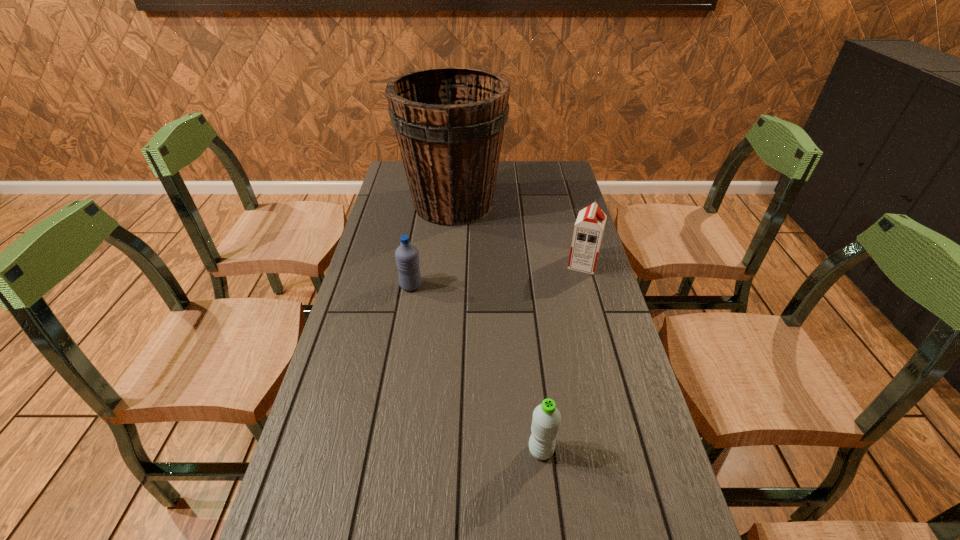
Find the location of a particular element. The image size is (960, 540). vacant space that is in between the right water bottle and the farther water bottle is located at coordinates (476, 368).

Find the location of a particular element. object that stands as the closest to the bucket is located at coordinates (588, 230).

Locate which object is the third closest to the bucket. Please provide its 2D coordinates. Your answer should be formatted as a tuple, i.e. [(x, y)], where the tuple contains the x and y coordinates of a point satisfying the conditions above.

[(546, 419)]

Where is `vacant space that satisfies the following two spatial constraints: 1. on the front side of the bucket; 2. on the right side of the nearer water bottle`? The width and height of the screenshot is (960, 540). vacant space that satisfies the following two spatial constraints: 1. on the front side of the bucket; 2. on the right side of the nearer water bottle is located at coordinates (432, 450).

Locate an element on the screen. Image resolution: width=960 pixels, height=540 pixels. blank area in the image that satisfies the following two spatial constraints: 1. on the front side of the farthest object; 2. on the right side of the second tallest object is located at coordinates (448, 264).

Identify the location of blank space that satisfies the following two spatial constraints: 1. on the front side of the right water bottle; 2. on the left side of the farther water bottle. (382, 450).